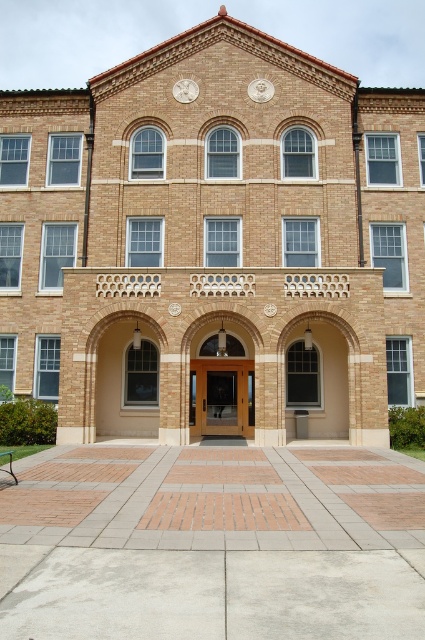
Can you confirm if wooden door at center is taller than white marble clock at upper center?

Yes.

Which is in front, point (212, 362) or point (192, 99)?

Point (212, 362) is more forward.

This screenshot has width=425, height=640. Describe the element at coordinates (221, 397) in the screenshot. I see `wooden door at center` at that location.

In order to click on wooden door at center in this screenshot , I will do `click(221, 397)`.